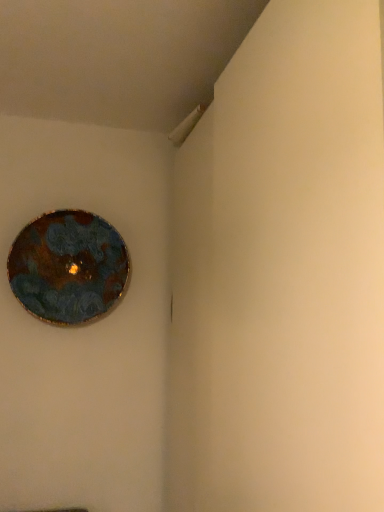
Where is `rustic metallic platter at lower left`? The width and height of the screenshot is (384, 512). rustic metallic platter at lower left is located at coordinates (68, 267).

The width and height of the screenshot is (384, 512). Describe the element at coordinates (68, 267) in the screenshot. I see `rustic metallic platter at lower left` at that location.

What is the approximate height of rustic metallic platter at lower left?

rustic metallic platter at lower left is 21.63 inches tall.

In order to click on rustic metallic platter at lower left in this screenshot , I will do `click(68, 267)`.